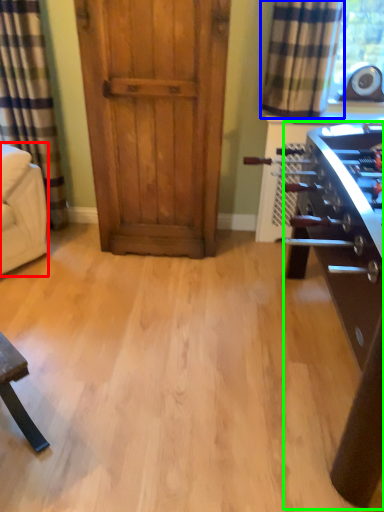
Question: Which object is the farthest from armchair (highlighted by a red box)? Choose among these: curtain (highlighted by a blue box) or table (highlighted by a green box).

Choices:
 (A) curtain
 (B) table

Answer: (B)